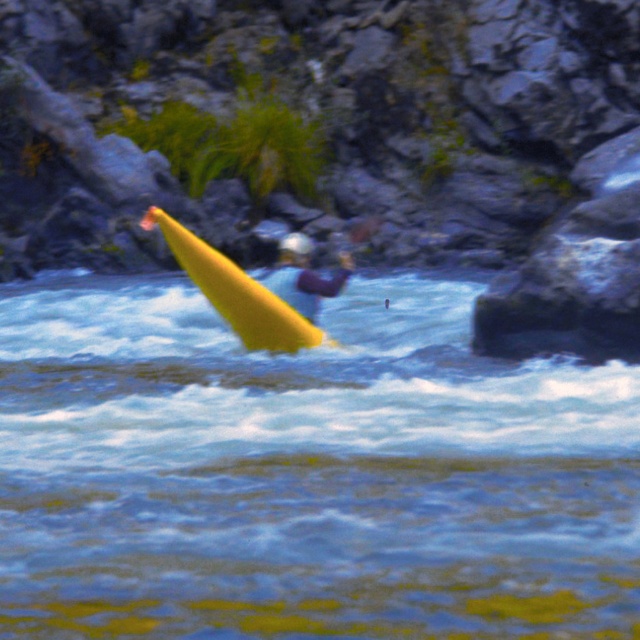
Question: Does yellow rubber boat at upper left have a larger size compared to shiny yellow canoe at center?

Choices:
 (A) yes
 (B) no

Answer: (A)

Question: Among these objects, which one is farthest from the camera?

Choices:
 (A) shiny yellow canoe at center
 (B) yellow rubber boat at upper left

Answer: (A)

Question: Considering the relative positions of yellow rubber boat at upper left and smooth purple helmet at center in the image provided, where is yellow rubber boat at upper left located with respect to smooth purple helmet at center?

Choices:
 (A) left
 (B) right

Answer: (A)

Question: Which object is farther from the camera taking this photo?

Choices:
 (A) shiny yellow canoe at center
 (B) yellow rubber boat at upper left

Answer: (A)

Question: Which of these objects is positioned closest to the smooth purple helmet at center?

Choices:
 (A) yellow rubber boat at upper left
 (B) shiny yellow canoe at center

Answer: (B)

Question: Does shiny yellow canoe at center appear under smooth purple helmet at center?

Choices:
 (A) no
 (B) yes

Answer: (B)